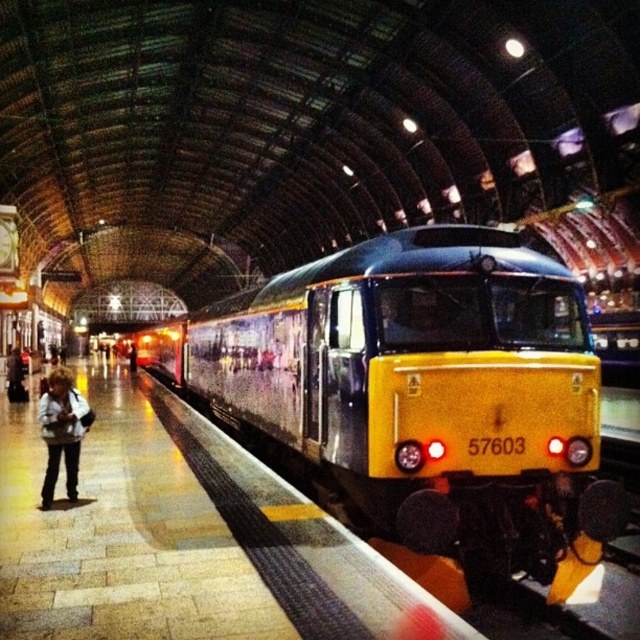
Does yellow polished metal train at center have a smaller size compared to denim jacket at left?

No.

Looking at this image, can you confirm if yellow polished metal train at center is positioned below denim jacket at left?

Actually, yellow polished metal train at center is above denim jacket at left.

Does point (330, 317) come in front of point (12, 381)?

That is True.

You are a GUI agent. You are given a task and a screenshot of the screen. Output one action in this format:
    pyautogui.click(x=<x>, y=<y>)
    Task: Click on the yellow polished metal train at center
    
    Given the screenshot: What is the action you would take?
    pyautogui.click(x=422, y=394)

Which is more to the left, yellow polished metal train at center or light brown leather jacket at lower left?

From the viewer's perspective, yellow polished metal train at center appears more on the left side.

Who is more forward, (582,524) or (58,380)?

Point (582,524) is in front.

This screenshot has height=640, width=640. What are the coordinates of `yellow polished metal train at center` in the screenshot? It's located at (422, 394).

Which of these two, light brown leather jacket at lower left or denim jacket at left, stands taller?

Standing taller between the two is light brown leather jacket at lower left.

Does light brown leather jacket at lower left appear on the left side of denim jacket at left?

No, light brown leather jacket at lower left is not to the left of denim jacket at left.

Between point (65, 388) and point (13, 349), which one is positioned behind?

The point (13, 349) is behind.

You are a GUI agent. You are given a task and a screenshot of the screen. Output one action in this format:
    pyautogui.click(x=<x>, y=<y>)
    Task: Click on the light brown leather jacket at lower left
    
    Given the screenshot: What is the action you would take?
    pyautogui.click(x=61, y=432)